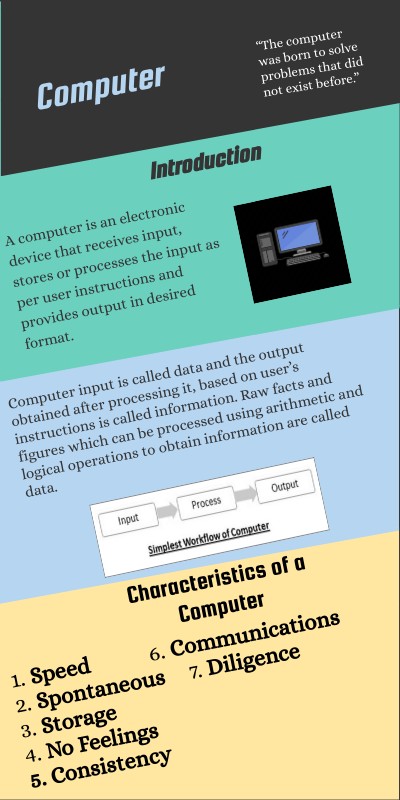
You are a GUI agent. You are given a task and a screenshot of the screen. Output one action in this format:
    pyautogui.click(x=<x>, y=<y>)
    Task: Click on the computer tower
    Image resolution: width=400 pixels, height=800 pixels.
    Given the screenshot: What is the action you would take?
    pyautogui.click(x=269, y=250)